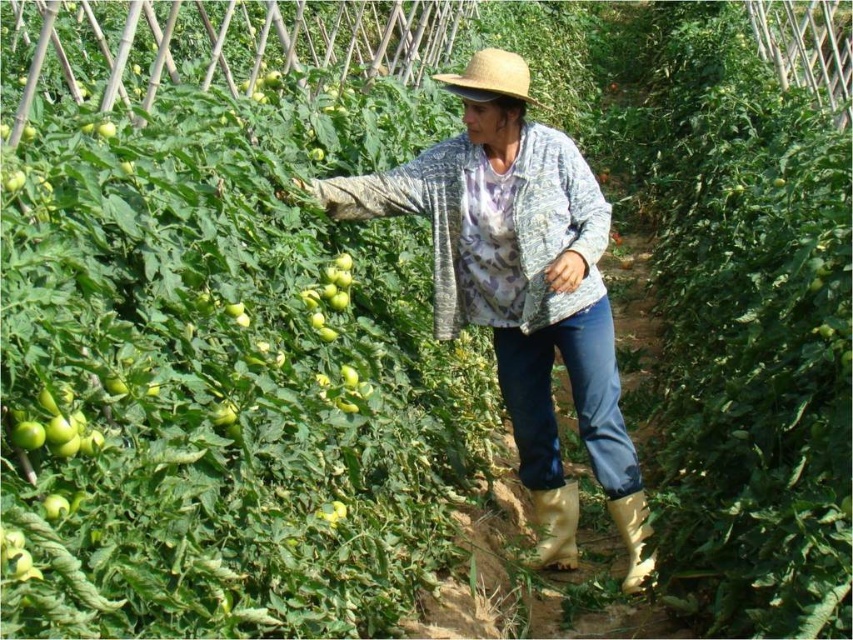
Between yellow rubber boot at lower center and green matte tomato at center, which one appears on the right side from the viewer's perspective?

Positioned to the right is yellow rubber boot at lower center.

Which is more to the left, yellow rubber boot at lower center or green matte tomato at center?

Positioned to the left is green matte tomato at center.

What do you see at coordinates (554, 528) in the screenshot? The height and width of the screenshot is (640, 853). I see `yellow rubber boot at lower center` at bounding box center [554, 528].

Where is `yellow rubber boot at lower center`? yellow rubber boot at lower center is located at coordinates (554, 528).

Between denim jacket at center and green matte tomato at center, which one appears on the left side from the viewer's perspective?

green matte tomato at center

Is point (611, 348) positioned before point (344, 307)?

No.

Find the location of `denim jacket at center`. denim jacket at center is located at coordinates (515, 273).

Measure the distance between denim jacket at center and yellow rubber boot at lower right.

denim jacket at center and yellow rubber boot at lower right are 33.31 inches apart from each other.

Can you confirm if denim jacket at center is positioned to the left of yellow rubber boot at lower right?

Yes, denim jacket at center is to the left of yellow rubber boot at lower right.

Locate an element on the screen. This screenshot has width=853, height=640. denim jacket at center is located at coordinates (515, 273).